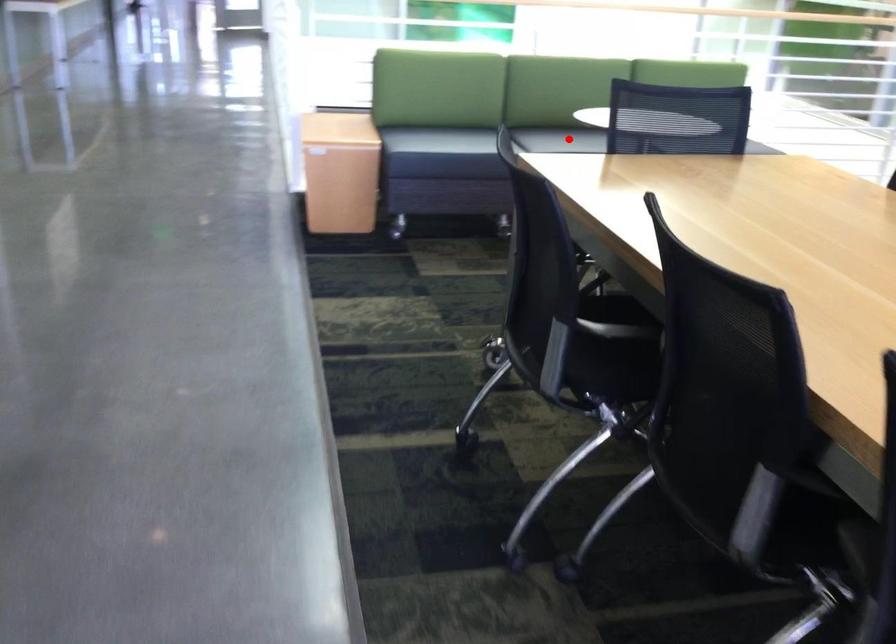
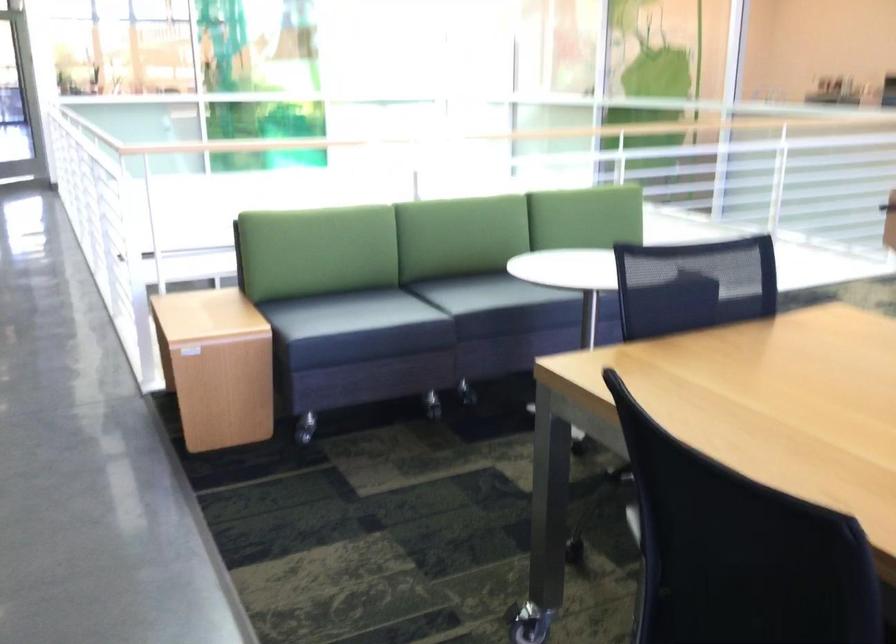
In the second image, find the point that corresponds to the highlighted location in the first image.

(488, 292)